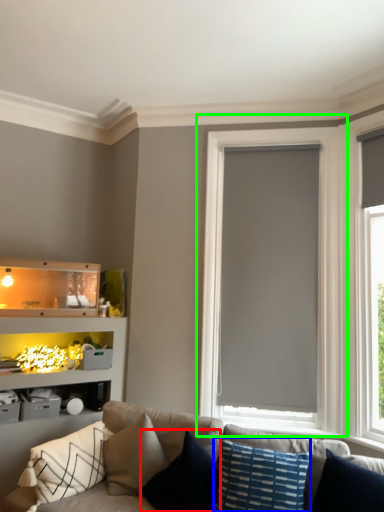
Question: Estimate the real-world distances between objects in this image. Which object is farther from pillow (highlighted by a red box), pillow (highlighted by a blue box) or window (highlighted by a green box)?

Choices:
 (A) pillow
 (B) window

Answer: (B)